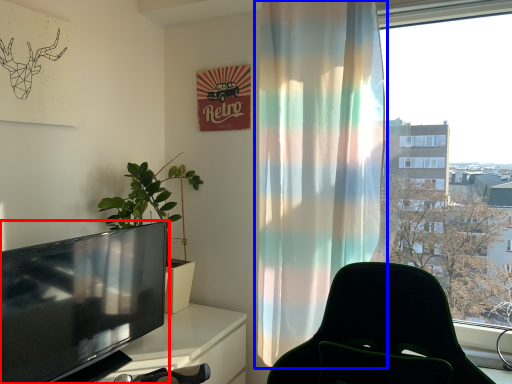
Question: Which object is closer to the camera taking this photo, television (highlighted by a red box) or curtain (highlighted by a blue box)?

Choices:
 (A) television
 (B) curtain

Answer: (A)